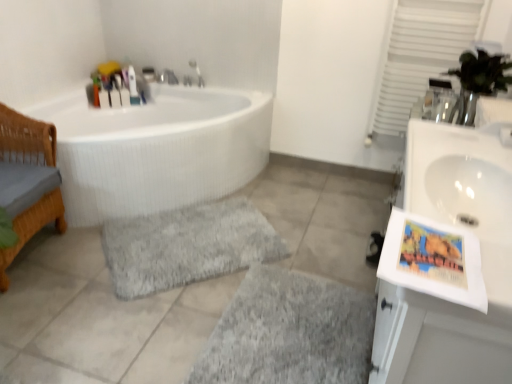
At what (x,y) coordinates should I click in order to perform the action: click on vacant space situated above gray shaggy bath mat at center, the first bath mat positioned from the top (from a real-world perspective). Please return your answer as a coordinate pair (x, y). The image size is (512, 384). Looking at the image, I should click on (179, 244).